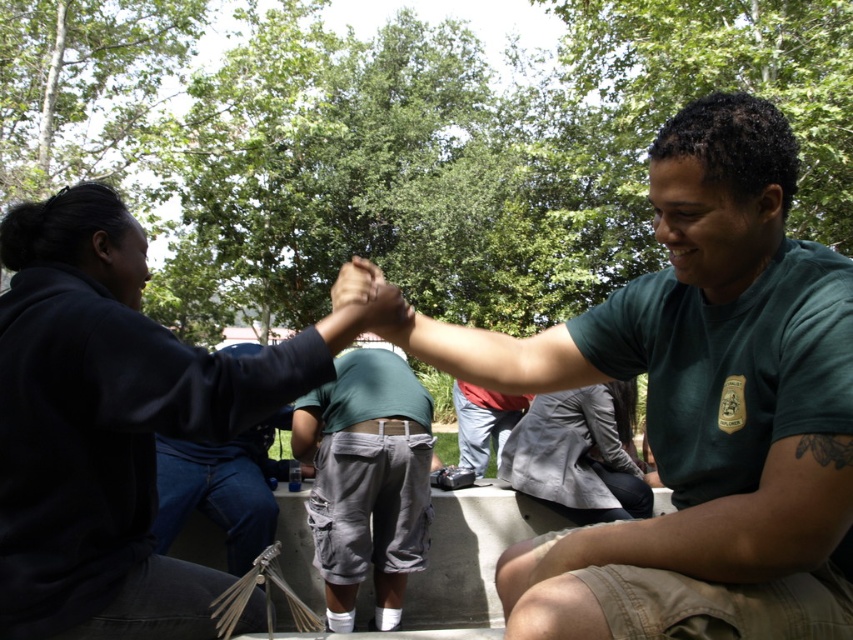
Is green uniform at center shorter than red shirt at center?

In fact, green uniform at center may be taller than red shirt at center.

Between green uniform at center and red shirt at center, which one has less height?

Standing shorter between the two is red shirt at center.

Between point (694, 540) and point (489, 401), which one is positioned behind?

Positioned behind is point (489, 401).

Locate an element on the screen. This screenshot has width=853, height=640. green uniform at center is located at coordinates (700, 406).

Is green uniform at center to the right of gray cotton cargo shorts at center from the viewer's perspective?

Correct, you'll find green uniform at center to the right of gray cotton cargo shorts at center.

Is green uniform at center smaller than gray cotton cargo shorts at center?

No.

The height and width of the screenshot is (640, 853). What are the coordinates of `green uniform at center` in the screenshot? It's located at (700, 406).

Identify the location of green uniform at center. (700, 406).

Between point (79, 184) and point (469, 417), which one is positioned in front?

Positioned in front is point (79, 184).

Who is lower down, dark blue fabric shirt at upper left or red shirt at center?

red shirt at center is below.

What do you see at coordinates (115, 422) in the screenshot? I see `dark blue fabric shirt at upper left` at bounding box center [115, 422].

Where is `dark blue fabric shirt at upper left`? Image resolution: width=853 pixels, height=640 pixels. dark blue fabric shirt at upper left is located at coordinates (115, 422).